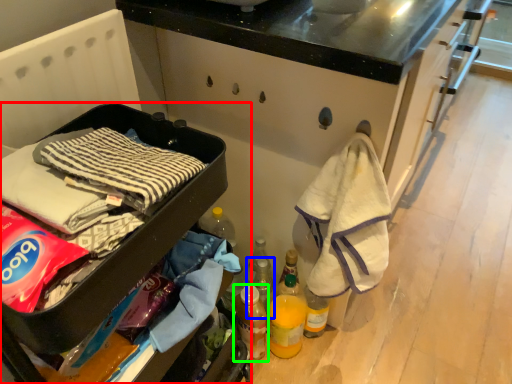
Question: Considering the real-world distances, which object is closest to furniture (highlighted by a red box)? bottle (highlighted by a blue box) or bottle (highlighted by a green box).

Choices:
 (A) bottle
 (B) bottle

Answer: (B)